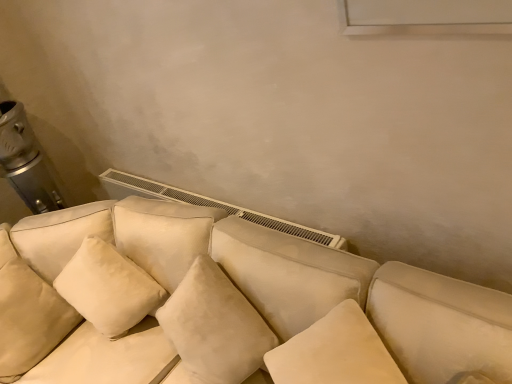
Question: In terms of height, does suede-like beige couch at center look taller or shorter compared to suede-like beige pillow at lower left?

Choices:
 (A) short
 (B) tall

Answer: (B)

Question: Relative to suede-like beige pillow at lower left, is suede-like beige couch at center in front or behind?

Choices:
 (A) behind
 (B) front

Answer: (B)

Question: Considering the positions of point coord(407,299) and point coord(4,332), is point coord(407,299) closer or farther from the camera than point coord(4,332)?

Choices:
 (A) farther
 (B) closer

Answer: (B)

Question: Is suede-like beige pillow at lower left in front of or behind suede-like beige couch at center in the image?

Choices:
 (A) behind
 (B) front

Answer: (A)

Question: From the image's perspective, relative to suede-like beige couch at center, is suede-like beige pillow at lower left above or below?

Choices:
 (A) below
 (B) above

Answer: (B)

Question: In terms of width, does suede-like beige pillow at lower left look wider or thinner when compared to suede-like beige couch at center?

Choices:
 (A) wide
 (B) thin

Answer: (B)

Question: Is point (41, 332) positioned closer to the camera than point (370, 266)?

Choices:
 (A) farther
 (B) closer

Answer: (A)